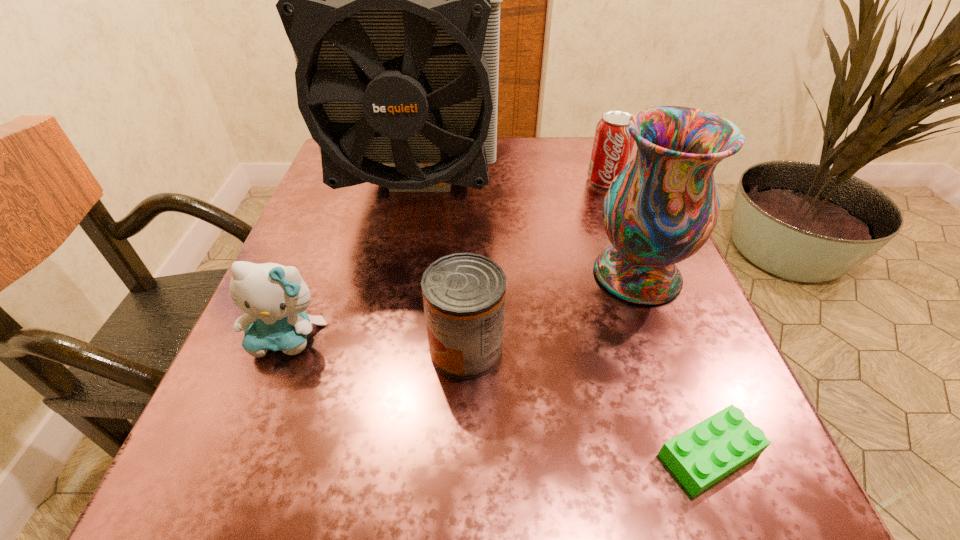
The height and width of the screenshot is (540, 960). I want to click on soda can positioned at the right edge, so click(x=612, y=148).

Locate an element on the screen. The height and width of the screenshot is (540, 960). Lego situated at the right edge is located at coordinates (701, 456).

Where is `object that is at the far left corner`? The width and height of the screenshot is (960, 540). object that is at the far left corner is located at coordinates (391, 0).

In order to click on object positioned at the far right corner in this screenshot , I will do `click(612, 148)`.

You are a GUI agent. You are given a task and a screenshot of the screen. Output one action in this format:
    pyautogui.click(x=<x>, y=<y>)
    Task: Click on the object that is at the near right corner
    Image resolution: width=960 pixels, height=540 pixels.
    Given the screenshot: What is the action you would take?
    pyautogui.click(x=701, y=456)

In the image, there is a desktop. Identify the location of vacant space at the far edge. The image size is (960, 540). (513, 151).

The height and width of the screenshot is (540, 960). In the image, there is a desktop. Identify the location of vacant space at the near edge. (431, 512).

This screenshot has height=540, width=960. In the image, there is a desktop. In order to click on vacant space at the left edge in this screenshot , I will do `click(317, 335)`.

The image size is (960, 540). In order to click on free space at the right edge of the desktop in this screenshot , I will do `click(618, 303)`.

Where is `free region at the far right corner`? The image size is (960, 540). free region at the far right corner is located at coordinates (584, 182).